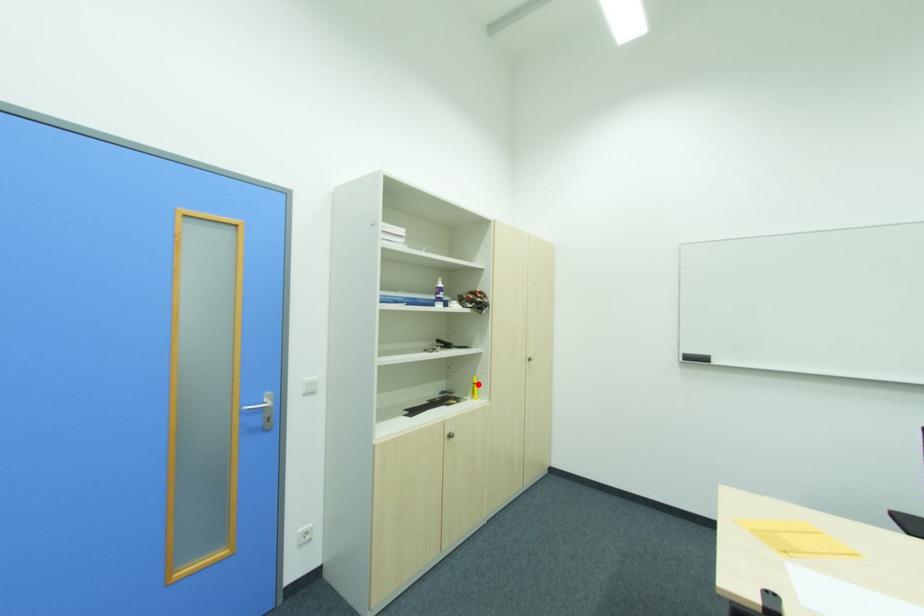
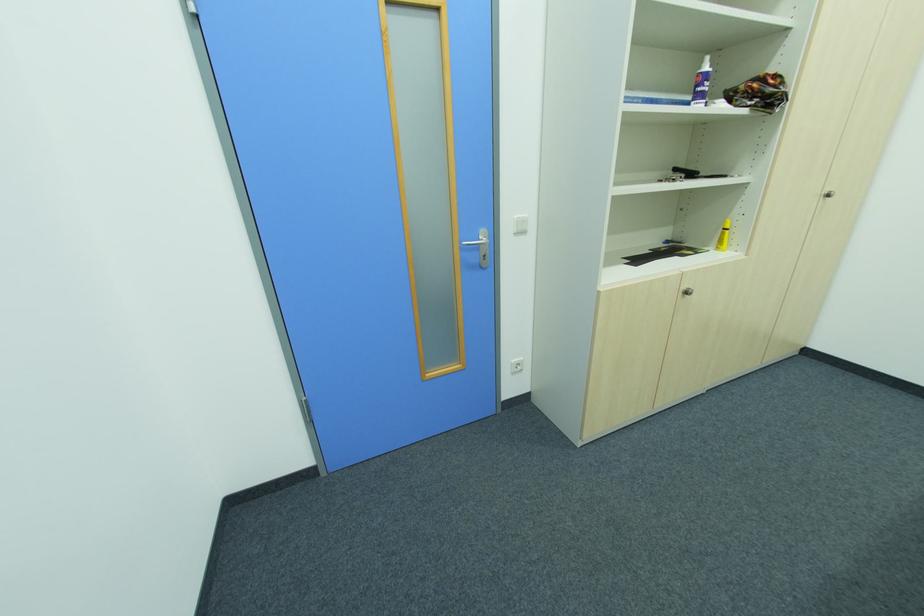
Question: A red point is marked in image1. In image2, is the corresponding 3D point closer to the camera or farther? Reply with the corresponding letter.

Choices:
 (A) The corresponding 3D point is closer.
 (B) The corresponding 3D point is farther.

Answer: (A)